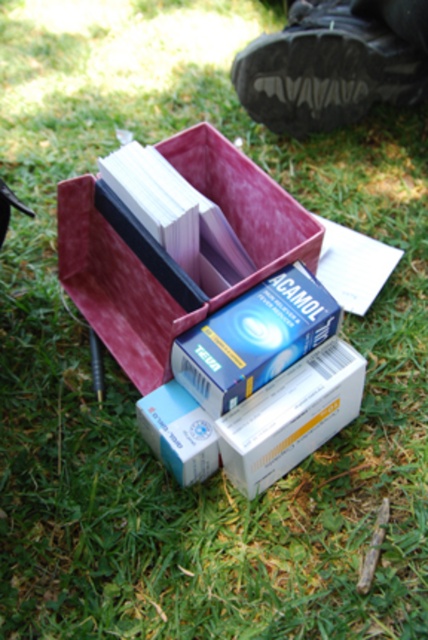
Question: Is white cardboard box at center smaller than matte purple book at center?

Choices:
 (A) yes
 (B) no

Answer: (A)

Question: Which is farther from the matte purple book at center?

Choices:
 (A) velvet-like pink shoe box at center
 (B) white cardboard box at center

Answer: (B)

Question: Is white cardboard box at center positioned before matte purple book at center?

Choices:
 (A) yes
 (B) no

Answer: (A)

Question: Which of the following is the closest to the observer?

Choices:
 (A) (308, 449)
 (B) (169, 444)
 (C) (262, 276)
 (D) (234, 275)

Answer: (B)

Question: Can you confirm if velvet-like pink shoe box at center is positioned to the left of blue cardboard box at center?

Choices:
 (A) yes
 (B) no

Answer: (B)

Question: Among these points, which one is nearest to the camera?

Choices:
 (A) (174, 410)
 (B) (262, 472)
 (C) (198, 241)

Answer: (B)